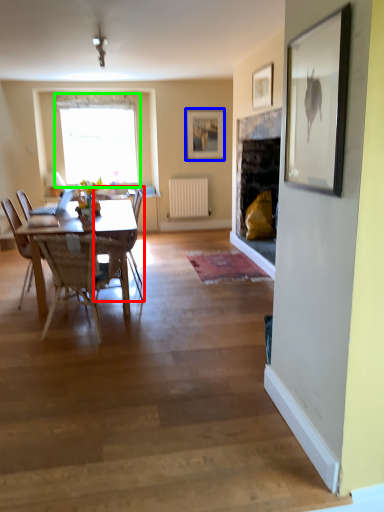
Question: Which is farther away from chair (highlighted by a red box)? picture frame (highlighted by a blue box) or window (highlighted by a green box)?

Choices:
 (A) picture frame
 (B) window

Answer: (A)